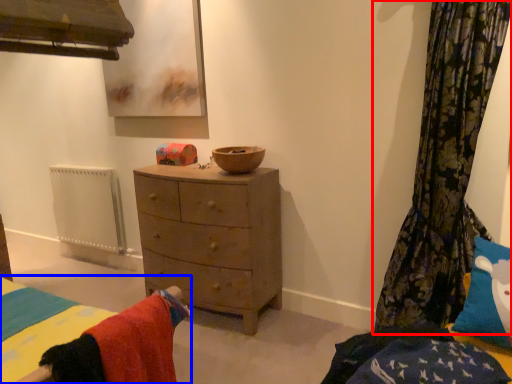
Question: Which object appears farthest to the camera in this image, curtain (highlighted by a red box) or bed (highlighted by a blue box)?

Choices:
 (A) curtain
 (B) bed

Answer: (A)